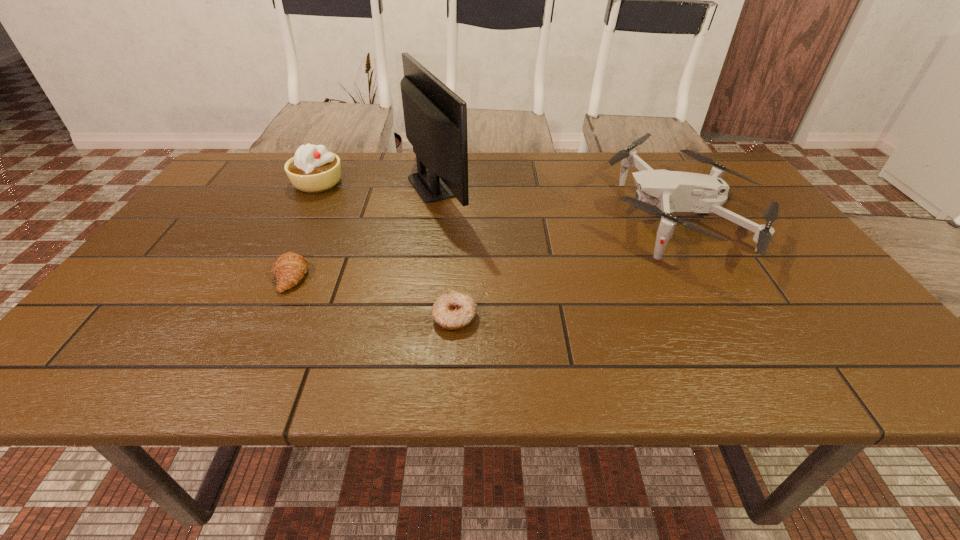
Where is `free space located on the back of the whipped cream`? The width and height of the screenshot is (960, 540). free space located on the back of the whipped cream is located at coordinates (333, 153).

The image size is (960, 540). In order to click on free space located 0.130m on the back of the fourth tallest object in this screenshot , I will do `click(314, 227)`.

The width and height of the screenshot is (960, 540). In order to click on vacant space situated on the front of the doughnut in this screenshot , I will do `click(451, 375)`.

In order to click on computer monitor that is at the far edge in this screenshot , I will do `click(435, 118)`.

Where is `drone present at the far edge`? This screenshot has height=540, width=960. drone present at the far edge is located at coordinates (660, 192).

At what (x,y) coordinates should I click in order to perform the action: click on whipped cream that is at the far edge. Please return your answer as a coordinate pair (x, y). Image resolution: width=960 pixels, height=540 pixels. Looking at the image, I should click on (313, 169).

This screenshot has height=540, width=960. Identify the location of object that is at the right edge. (660, 192).

Identify the location of object present at the far right corner. The image size is (960, 540). (660, 192).

In the image, there is a desktop. Where is `free space at the far edge`? free space at the far edge is located at coordinates (660, 158).

Find the location of `vacant region at the near edge of the desktop`. vacant region at the near edge of the desktop is located at coordinates (703, 368).